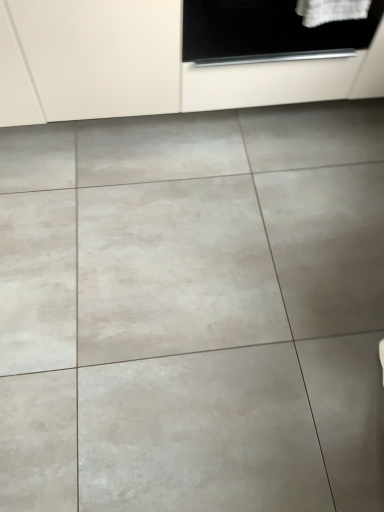
Question: Should I look upward or downward to see white matte cabinet at upper center?

Choices:
 (A) down
 (B) up

Answer: (B)